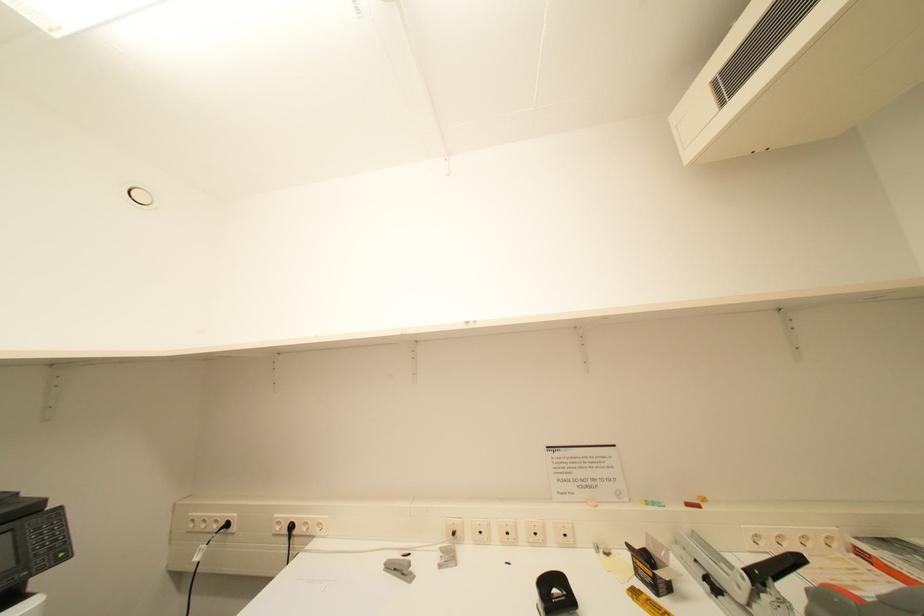
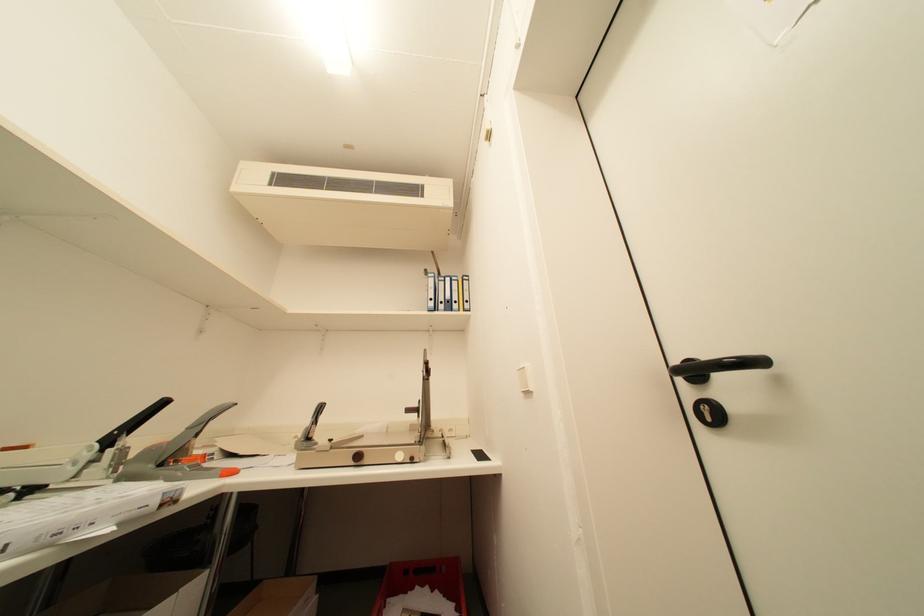
The images are taken continuously from a first-person perspective. In which direction is your viewpoint rotating?

The camera's rotation is toward right-up.